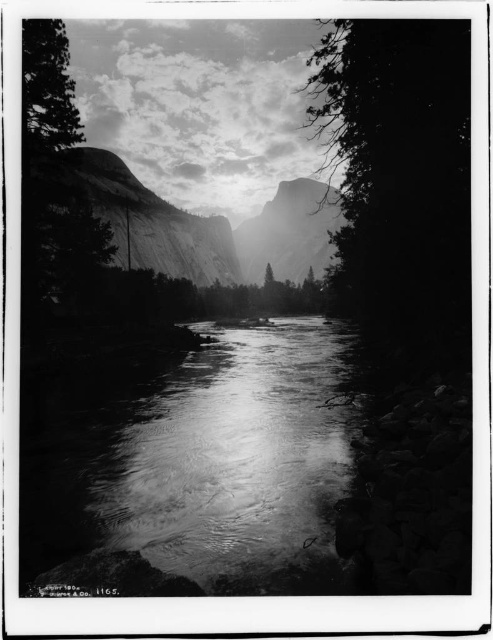
Is point (111, 241) less distant than point (316, 193)?

Yes.

Can you confirm if granite rock formation at center is positioned above smooth granite mountain at center?

No, granite rock formation at center is not above smooth granite mountain at center.

Who is more distant from viewer, (198, 216) or (323, 221)?

Positioned behind is point (323, 221).

Find the location of `granite rock formation at center`. granite rock formation at center is located at coordinates (145, 220).

Is smooth water at center positioned in front of granite rock formation at center?

Yes, it is in front of granite rock formation at center.

Is smooth water at center to the left of granite rock formation at center from the viewer's perspective?

No, smooth water at center is not to the left of granite rock formation at center.

Does point (319, 582) come farther from viewer compared to point (114, 198)?

No, it is not.

Identify the location of smooth water at center. This screenshot has height=640, width=493. (211, 472).

Based on the photo, does smooth granite mountain at center have a smaller size compared to smooth bark tree at left?

Incorrect, smooth granite mountain at center is not smaller in size than smooth bark tree at left.

Which is in front, point (277, 224) or point (28, 81)?

Point (28, 81)

Does point (325, 216) come closer to viewer compared to point (68, 138)?

No.

Where is `smooth granite mountain at center`? The height and width of the screenshot is (640, 493). smooth granite mountain at center is located at coordinates (289, 232).